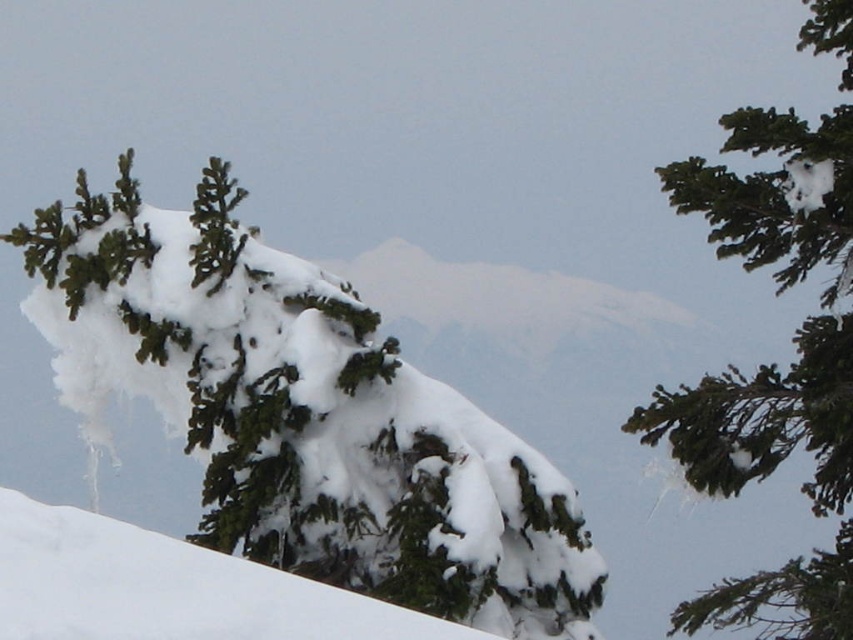
You are an observer looking at the winter landscape. You notice the green matte evergreen tree at upper center and the green matte tree branch at upper right. Which of these two objects is located closer to the bottom of the image?

The green matte evergreen tree at upper center is positioned under the green matte tree branch at upper right, meaning it is closer to the bottom of the image.

You are a hiker planning to take a photo of the green matte evergreen tree at upper center and the white snow at center. Which object should you focus on first if you want to ensure both are in the frame without moving the camera?

You should focus on the green matte evergreen tree at upper center first because it is larger in size compared to the white snow at center, making it easier to center in the frame.

You are a hiker who wants to take a photo of the green matte evergreen tree at upper center and the white snow at center. How far apart are these two elements in the image?

The green matte evergreen tree at upper center is 9.63 feet away from the white snow at center.